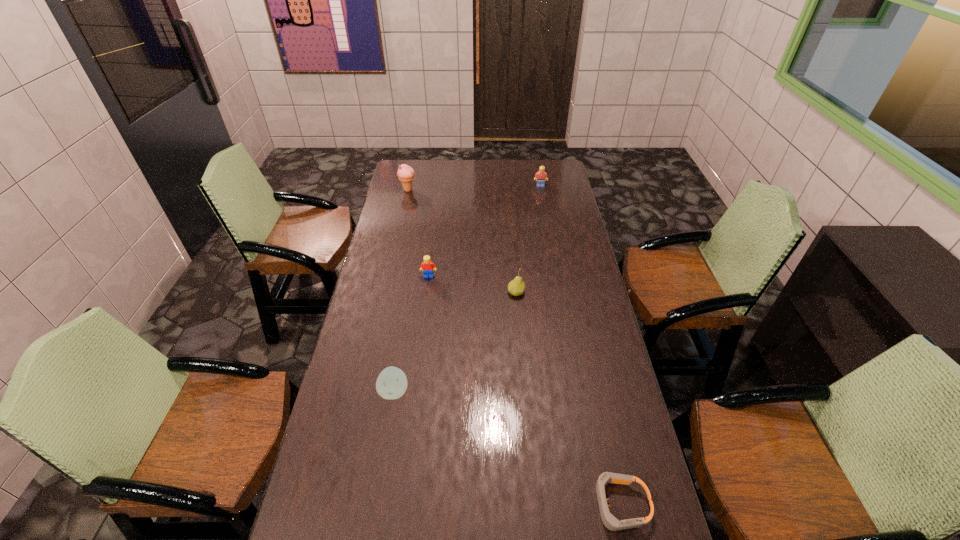
Identify the location of free point between the fourth object from left to right and the leftmost object. (462, 241).

You are a GUI agent. You are given a task and a screenshot of the screen. Output one action in this format:
    pyautogui.click(x=<x>, y=<y>)
    Task: Click on the vacant area between the nearest object and the icecream
    
    Given the screenshot: What is the action you would take?
    pyautogui.click(x=514, y=347)

The height and width of the screenshot is (540, 960). Identify the location of empty space that is in between the fifth farthest object and the goggles. (507, 448).

Where is `free space that is in between the fourth farthest object and the left Lego`? This screenshot has height=540, width=960. free space that is in between the fourth farthest object and the left Lego is located at coordinates (472, 285).

Image resolution: width=960 pixels, height=540 pixels. I want to click on free space between the leftmost object and the shortest object, so click(x=514, y=347).

Identify which object is the fourth nearest to the right Lego. Please provide its 2D coordinates. Your answer should be formatted as a tuple, i.e. [(x, y)], where the tuple contains the x and y coordinates of a point satisfying the conditions above.

[(391, 383)]

Choose which object is the second nearest neighbor to the fourth object from left to right. Please provide its 2D coordinates. Your answer should be formatted as a tuple, i.e. [(x, y)], where the tuple contains the x and y coordinates of a point satisfying the conditions above.

[(391, 383)]

The image size is (960, 540). I want to click on vacant space that satisfies the following two spatial constraints: 1. on the face of the fourth nearest object; 2. on the left side of the fourth farthest object, so click(x=427, y=293).